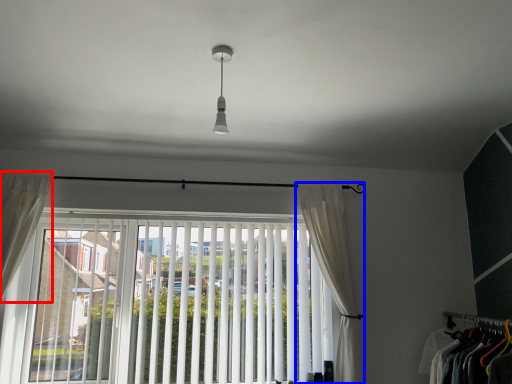
Question: Which object appears farthest to the camera in this image, curtain (highlighted by a red box) or curtain (highlighted by a blue box)?

Choices:
 (A) curtain
 (B) curtain

Answer: (B)